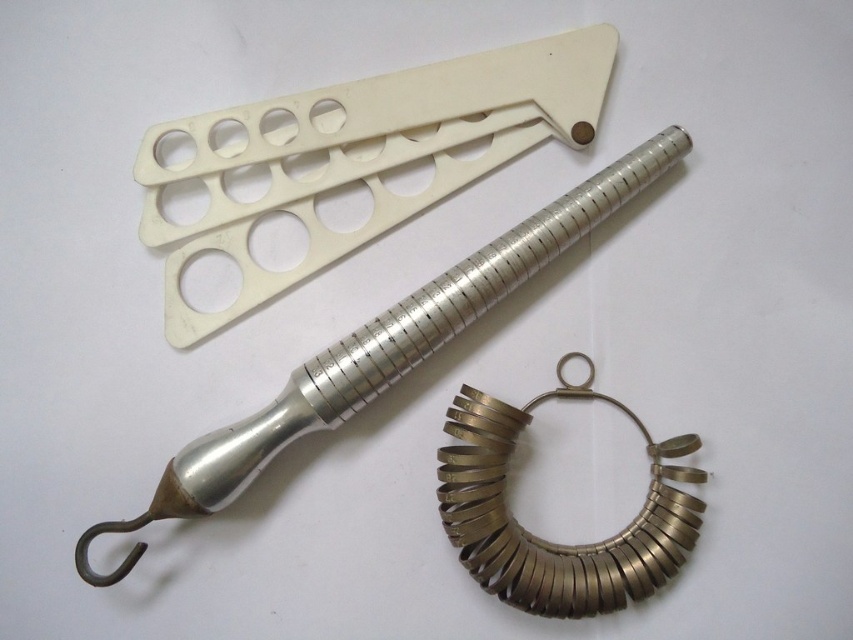
Question: Which object appears farthest from the camera in this image?

Choices:
 (A) silver metallic hook at lower left
 (B) gold metallic ring at lower center

Answer: (B)

Question: Is silver metallic hook at lower left to the left of gold metallic ring at lower center from the viewer's perspective?

Choices:
 (A) no
 (B) yes

Answer: (B)

Question: Does silver metallic hook at lower left have a lesser width compared to gold metallic ring at lower center?

Choices:
 (A) yes
 (B) no

Answer: (B)

Question: Does silver metallic hook at lower left appear over gold metallic ring at lower center?

Choices:
 (A) yes
 (B) no

Answer: (A)

Question: Which object appears closest to the camera in this image?

Choices:
 (A) silver metallic hook at lower left
 (B) gold metallic ring at lower center

Answer: (A)